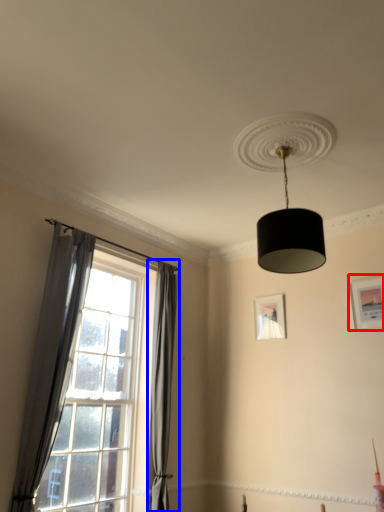
Question: Which object is further to the camera taking this photo, picture frame (highlighted by a red box) or curtain (highlighted by a blue box)?

Choices:
 (A) picture frame
 (B) curtain

Answer: (A)